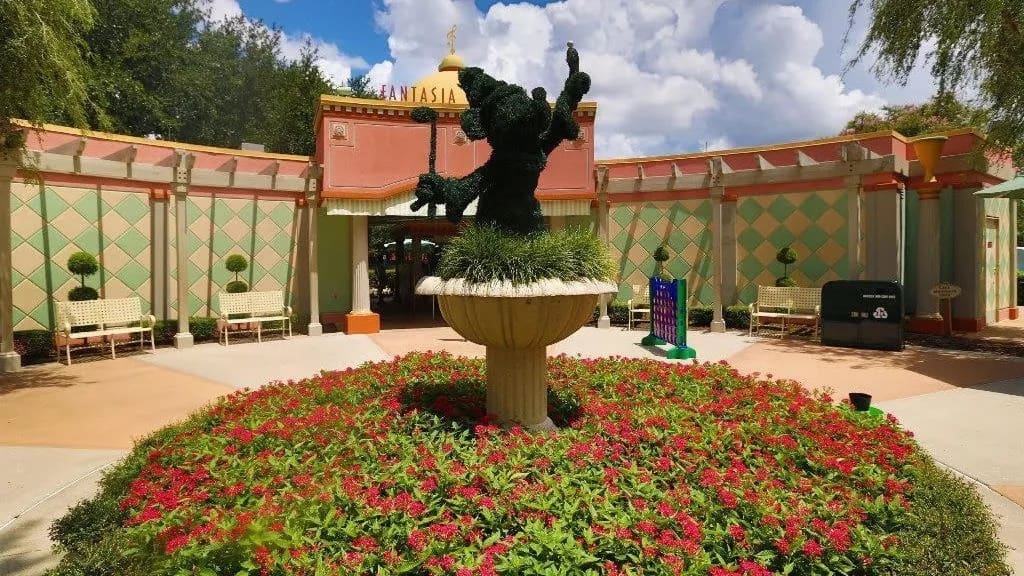
Locate an element on the screen. This screenshot has height=576, width=1024. pedestal is located at coordinates (517, 376).